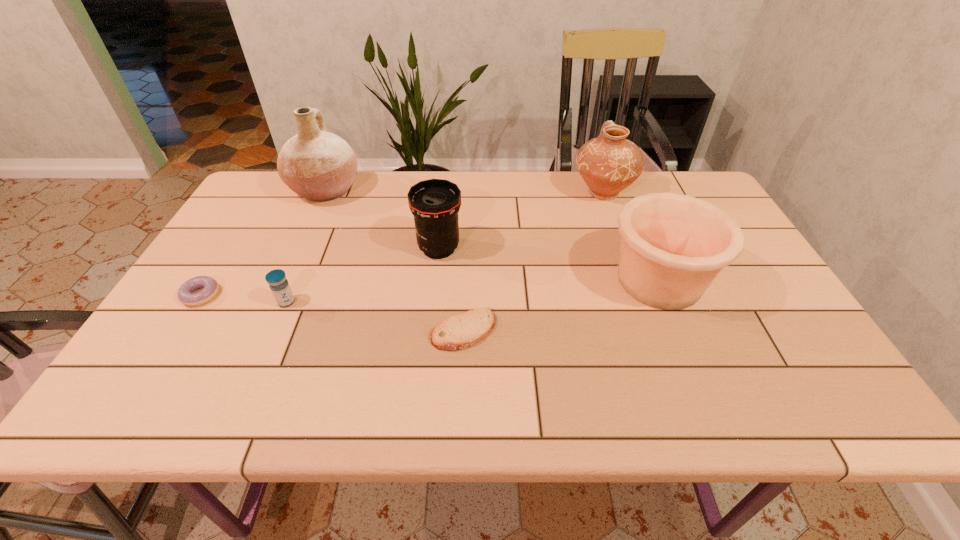
This screenshot has height=540, width=960. Find the location of `free space between the second tallest object and the leftmost object`. free space between the second tallest object and the leftmost object is located at coordinates (402, 244).

You are a GUI agent. You are given a task and a screenshot of the screen. Output one action in this format:
    pyautogui.click(x=<x>, y=<y>)
    Task: Click on the empty location between the nearest pottery and the fifth tallest object
    This screenshot has height=540, width=960.
    Given the screenshot: What is the action you would take?
    pyautogui.click(x=472, y=292)

This screenshot has width=960, height=540. I want to click on vacant point located between the telephoto lens and the fifth tallest object, so click(363, 275).

Identify which object is the fifth nearest to the tallest pottery. Please provide its 2D coordinates. Your answer should be formatted as a tuple, i.e. [(x, y)], where the tuple contains the x and y coordinates of a point satisfying the conditions above.

[(609, 163)]

Identify which object is the fourth nearest to the telephoto lens. Please provide its 2D coordinates. Your answer should be formatted as a tuple, i.e. [(x, y)], where the tuple contains the x and y coordinates of a point satisfying the conditions above.

[(609, 163)]

Identify which pottery is the nearest to the nearest pottery. Please provide its 2D coordinates. Your answer should be formatted as a tuple, i.e. [(x, y)], where the tuple contains the x and y coordinates of a point satisfying the conditions above.

[(609, 163)]

This screenshot has height=540, width=960. In order to click on pottery that is the closest to the telephoto lens in this screenshot , I will do `click(320, 166)`.

This screenshot has height=540, width=960. Find the location of `free location that satisfies the following two spatial constraints: 1. to pour from the handle of the tallest object; 2. on the side of the second tallest pottery with the handle`. free location that satisfies the following two spatial constraints: 1. to pour from the handle of the tallest object; 2. on the side of the second tallest pottery with the handle is located at coordinates (324, 193).

You are a GUI agent. You are given a task and a screenshot of the screen. Output one action in this format:
    pyautogui.click(x=<x>, y=<y>)
    Task: Click on the vacant point that satisfies the following two spatial constraints: 1. on the side of the sixth shortest object with the handle; 2. to pour from the handle of the leftmost pottery
    The height and width of the screenshot is (540, 960).
    Given the screenshot: What is the action you would take?
    pyautogui.click(x=602, y=190)

Locate an element on the screen. Image resolution: width=960 pixels, height=540 pixels. vacant area in the image that satisfies the following two spatial constraints: 1. on the side of the second shortest pottery with the handle; 2. to pour from the handle of the leftmost pottery is located at coordinates (602, 190).